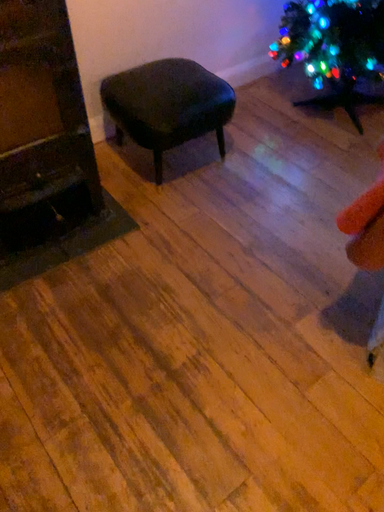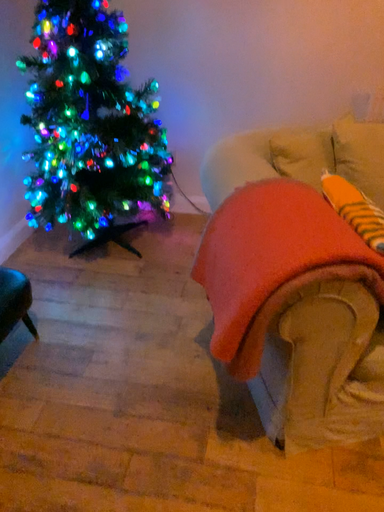
Question: How did the camera likely rotate when shooting the video?

Choices:
 (A) rotated upward
 (B) rotated downward

Answer: (A)